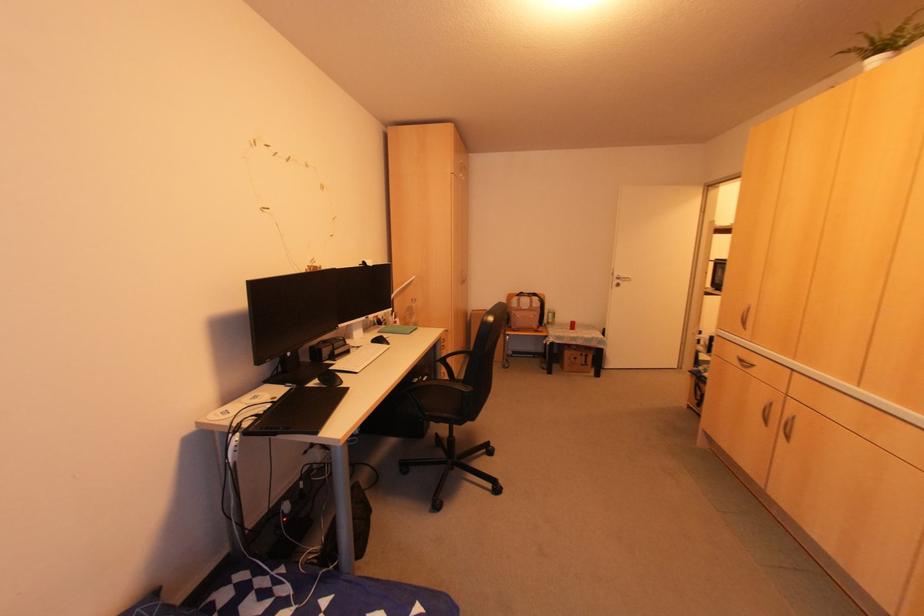
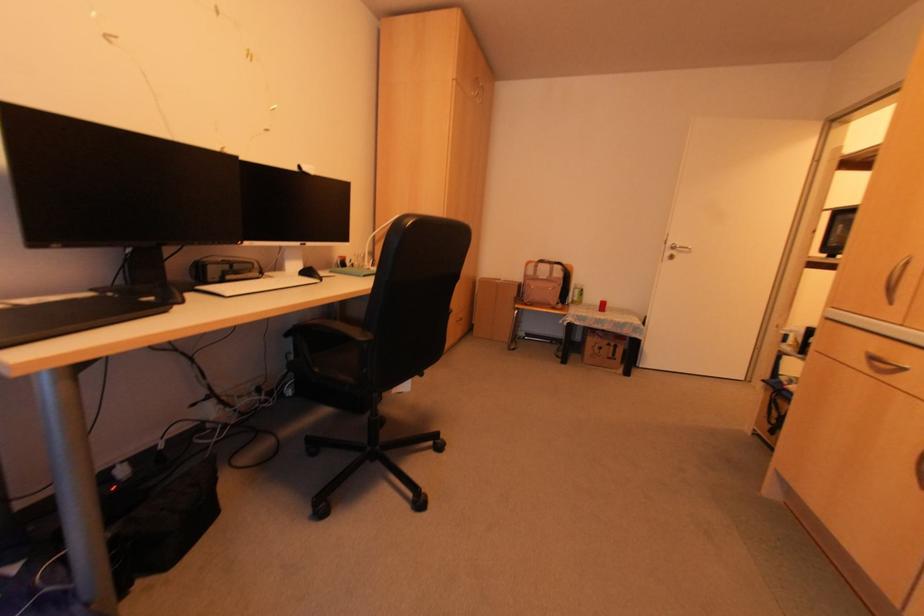
Question: Based on the continuous images, in which direction is the camera rotating? Reply with the corresponding letter.

Choices:
 (A) Left
 (B) Right
 (C) Up
 (D) Down

Answer: (A)